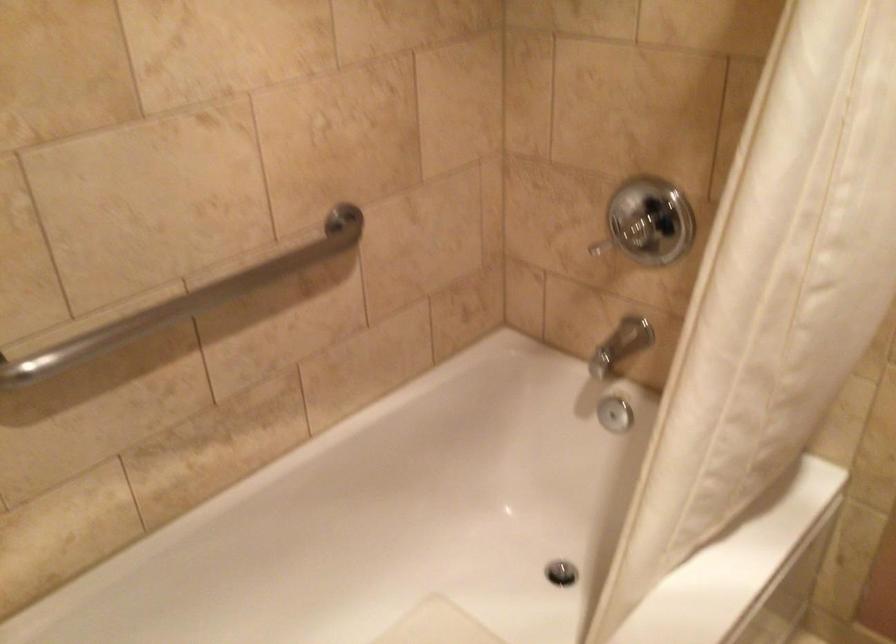
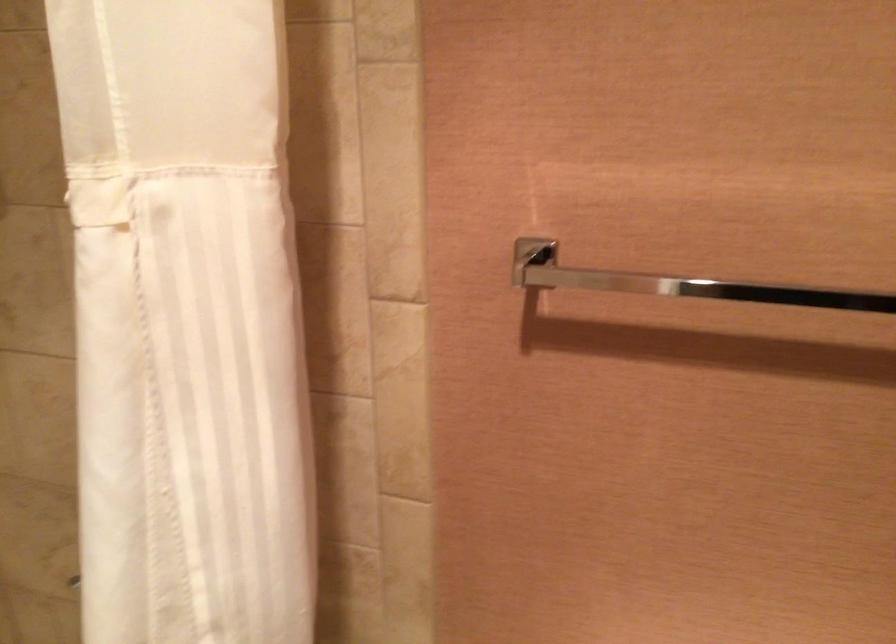
Question: The first image is from the beginning of the video and the second image is from the end. How did the camera likely rotate when shooting the video?

Choices:
 (A) Left
 (B) Right
 (C) Up
 (D) Down

Answer: (B)